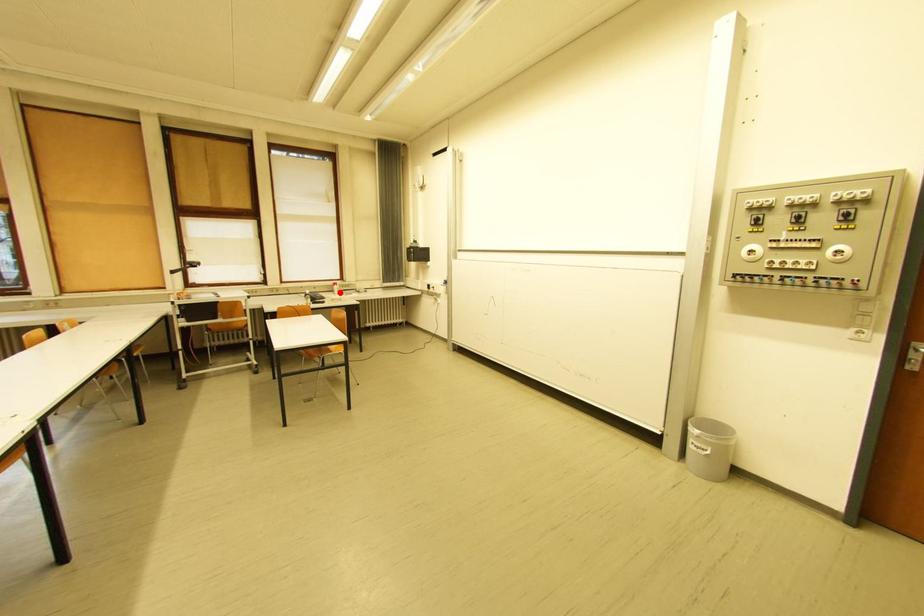
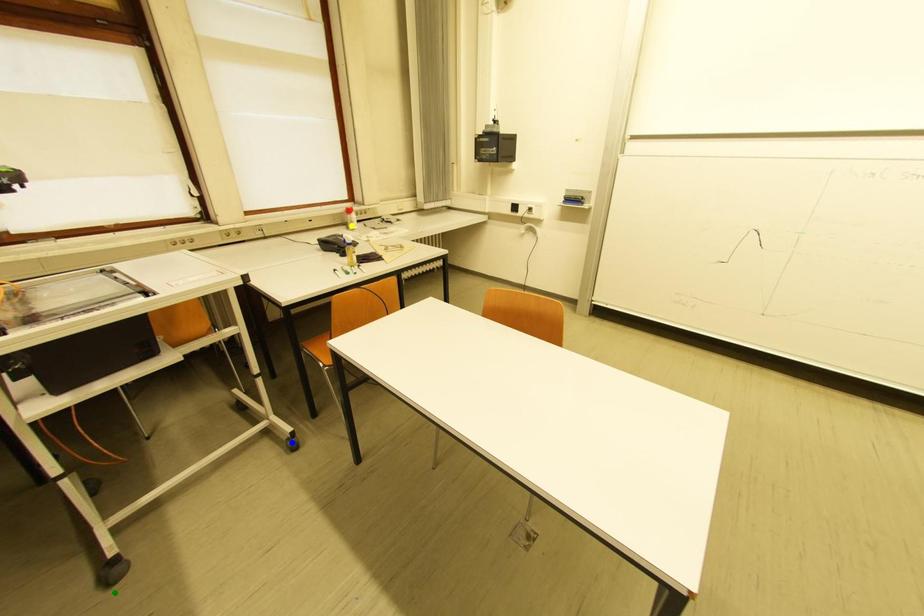
Question: I am providing you with two images of the same scene from different viewpoints. A red point is marked on the first image. You are given multiple points on the second image. Can you choose the point in image 2 that corresponds to the point in image 1?

Choices:
 (A) blue point
 (B) yellow point
 (C) green point

Answer: (B)